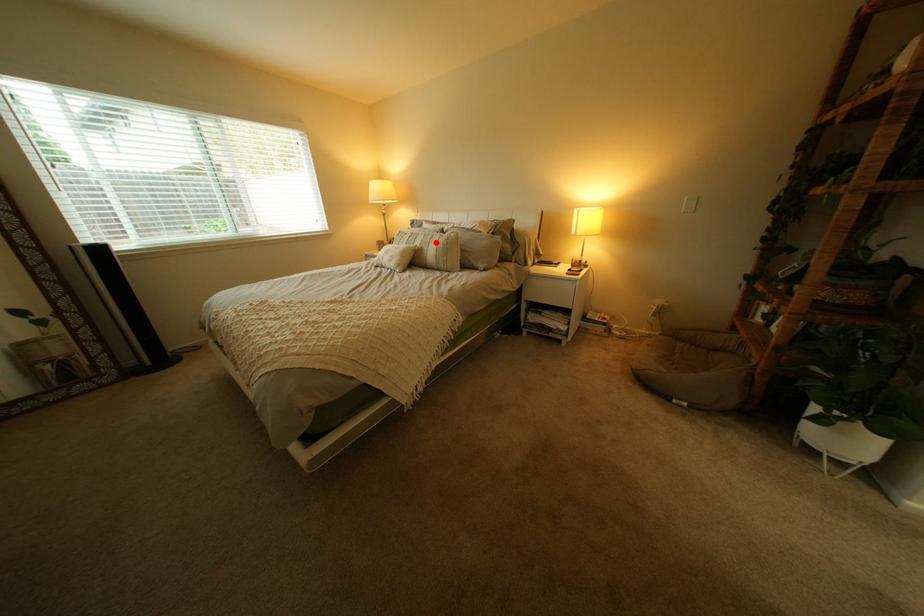
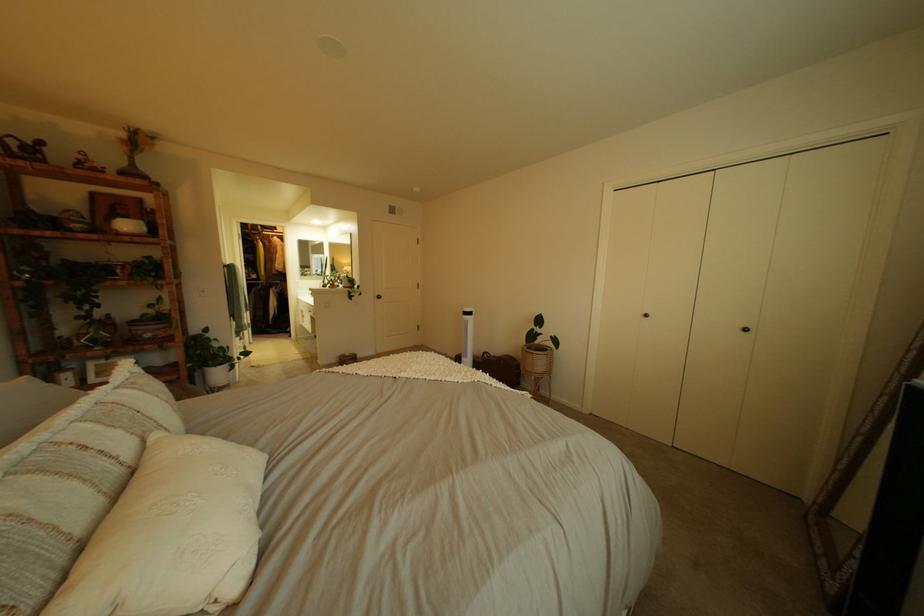
Question: A red point is marked in image1. In image2, is the corresponding 3D point closer to the camera or farther? Reply with the corresponding letter.

Choices:
 (A) The corresponding 3D point is closer.
 (B) The corresponding 3D point is farther.

Answer: (B)